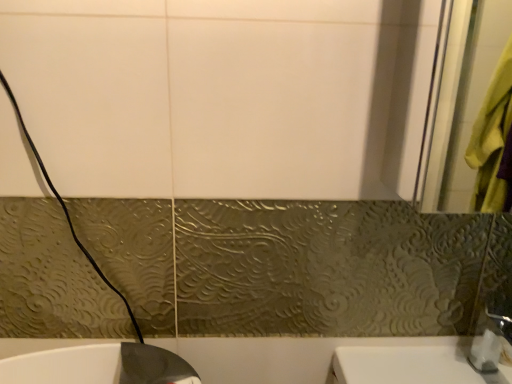
Question: Should I look upward or downward to see white glossy sink at lower left?

Choices:
 (A) down
 (B) up

Answer: (A)